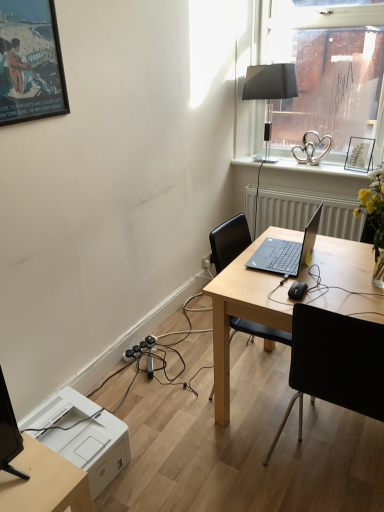
Find the location of a particular element. This screenshot has width=384, height=512. free point above light wood desk at center (from a real-world perspective) is located at coordinates (322, 268).